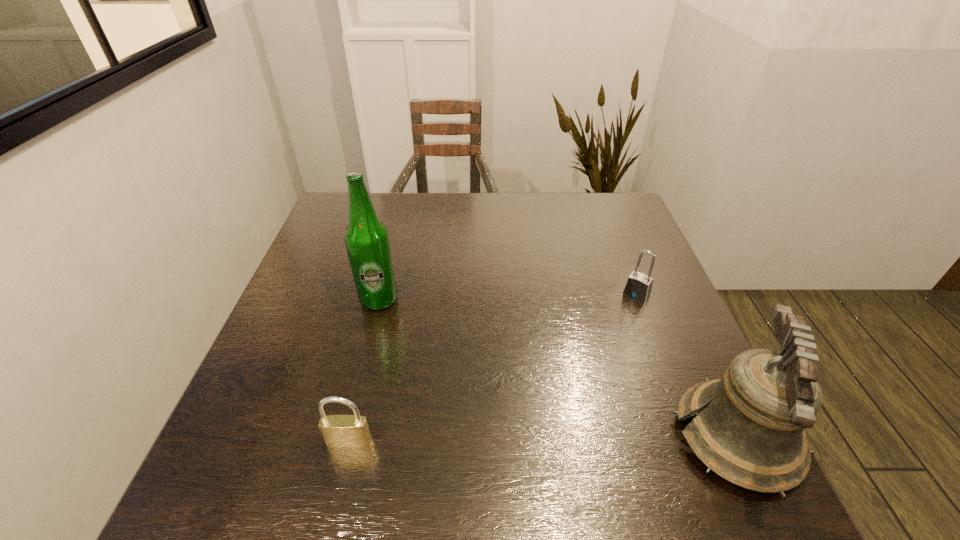
I want to click on free space between the tallest object and the second tallest object, so click(558, 369).

Where is `free point between the right padlock and the beer bottle`? The image size is (960, 540). free point between the right padlock and the beer bottle is located at coordinates (508, 297).

Identify the location of free spot between the farther padlock and the tallest object. (508, 297).

Identify the location of the second closest object to the right padlock. (366, 238).

Identify which object is located as the third nearest to the right padlock. Please provide its 2D coordinates. Your answer should be formatted as a tuple, i.e. [(x, y)], where the tuple contains the x and y coordinates of a point satisfying the conditions above.

[(344, 431)]